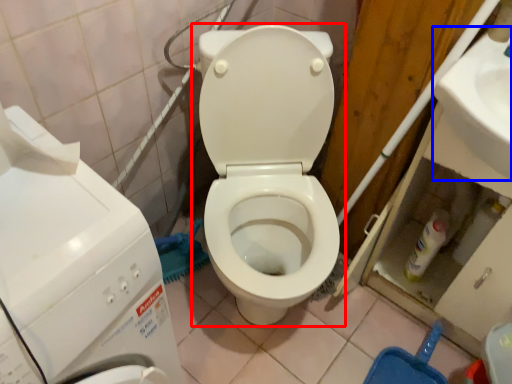
Question: Which of the following is the farthest to the observer, toilet (highlighted by a red box) or sink (highlighted by a blue box)?

Choices:
 (A) toilet
 (B) sink

Answer: (B)